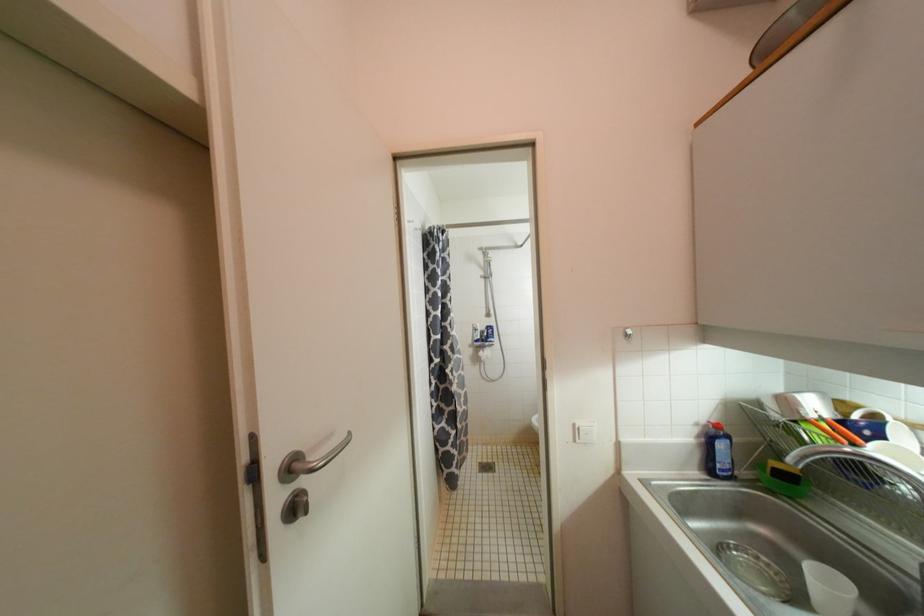
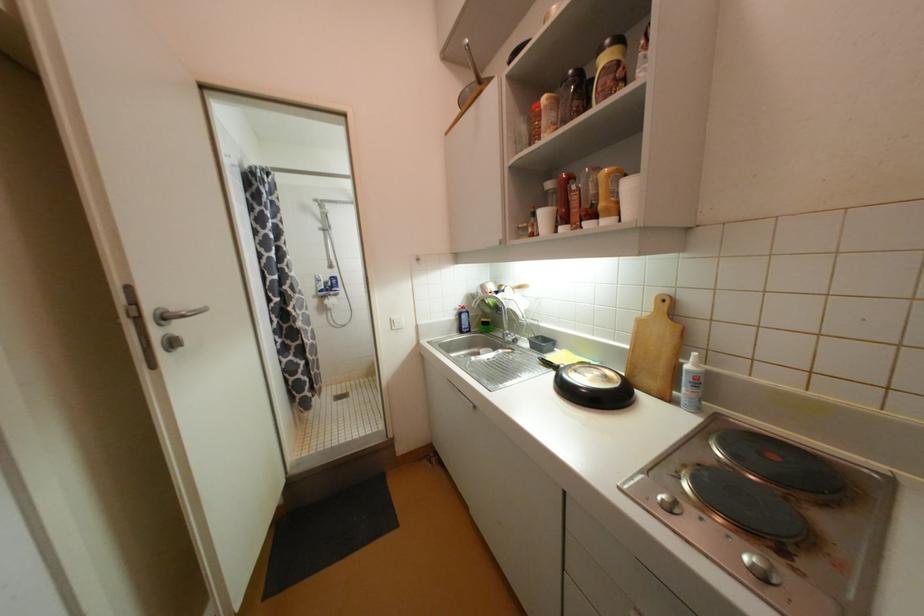
Question: I am providing you with two images of the same scene from different viewpoints. Which of the following objects are not visible in image2?

Choices:
 (A) white paper cup
 (B) white light switch
 (C) yellow squeeze bottle
 (D) none of these

Answer: (D)